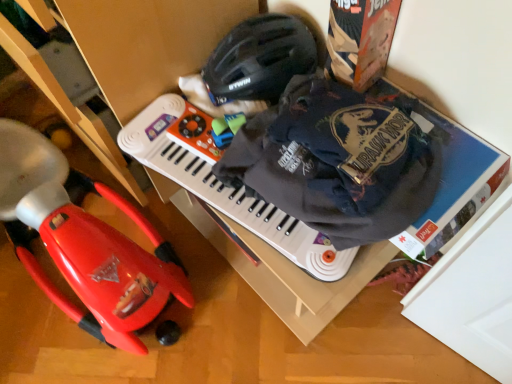
You are a GUI agent. You are given a task and a screenshot of the screen. Output one action in this format:
    pyautogui.click(x=<x>, y=<y>)
    Task: Click on the free point above white plastic musical keyboard at center (from a real-world perspective)
    
    Given the screenshot: What is the action you would take?
    pyautogui.click(x=218, y=173)